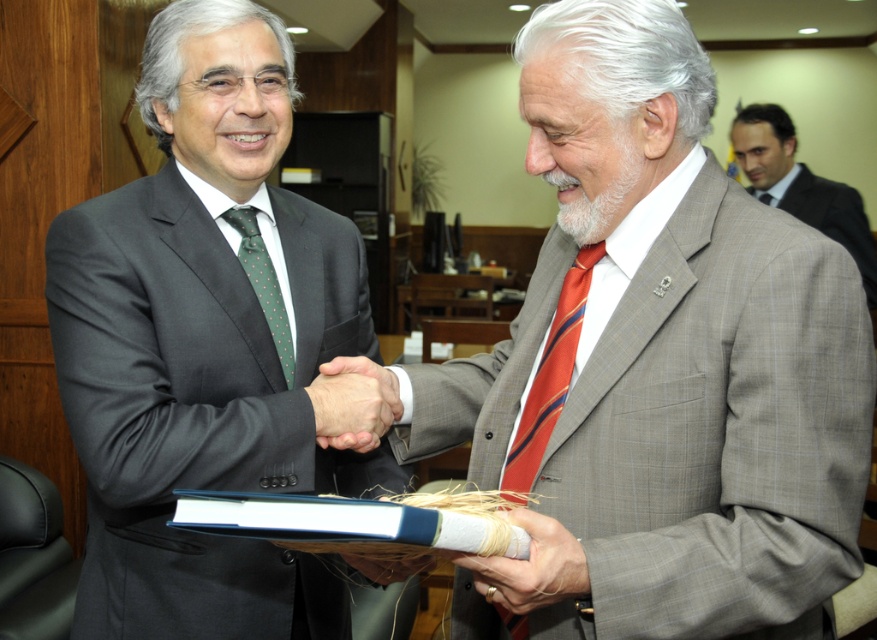
You are an event planner arranging a photo shoot in an office setting. You need to position two models wearing the matte black suit at center and the gray textured suit at upper right. Based on the provided image, which model should be placed lower in the frame to maintain the original composition?

The matte black suit at center should be placed lower in the frame because it is located below the gray textured suit at upper right in the original image.

You are a photographer standing at point (801, 186). You want to capture a photo of the gray textured suit at upper right and the man on the left. Which object is closer to your current position?

The gray textured suit at upper right is closer to your current position at point (801, 186) than the man on the left.